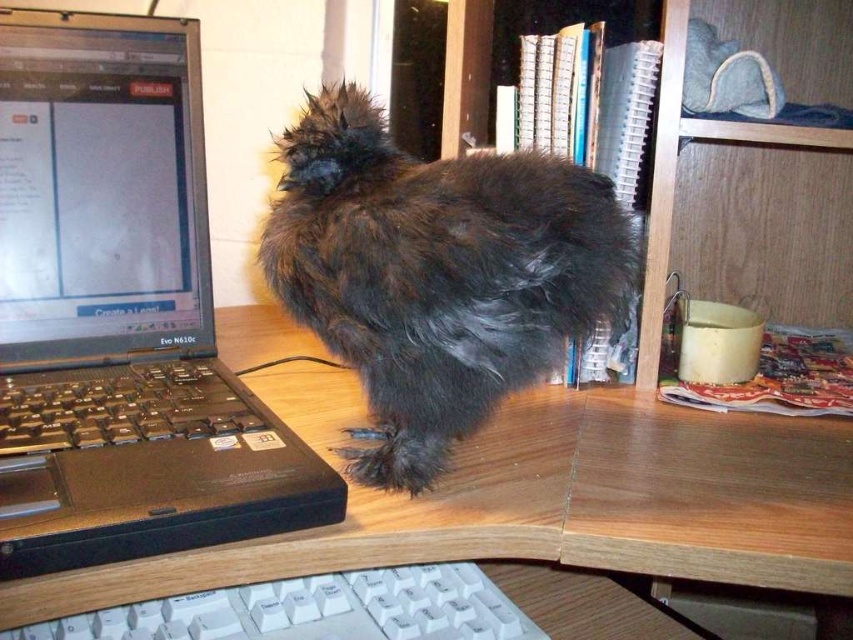
Can you confirm if black plastic laptop at left is positioned above black plastic keyboard at left?

Yes, black plastic laptop at left is above black plastic keyboard at left.

Does black plastic laptop at left come behind black plastic keyboard at left?

No, it is in front of black plastic keyboard at left.

Locate an element on the screen. black plastic laptop at left is located at coordinates (120, 310).

Locate an element on the screen. black plastic laptop at left is located at coordinates (120, 310).

Can you confirm if wooden bookshelf at upper right is wider than white plastic keyboard at lower center?

No.

Is wooden bookshelf at upper right taller than white plastic keyboard at lower center?

Indeed, wooden bookshelf at upper right has a greater height compared to white plastic keyboard at lower center.

Identify the location of wooden bookshelf at upper right. (753, 172).

What do you see at coordinates (555, 508) in the screenshot? This screenshot has width=853, height=640. I see `wooden at center` at bounding box center [555, 508].

Where is `wooden at center`? The height and width of the screenshot is (640, 853). wooden at center is located at coordinates (555, 508).

Find the location of a particular element. Image resolution: width=853 pixels, height=640 pixels. wooden at center is located at coordinates (555, 508).